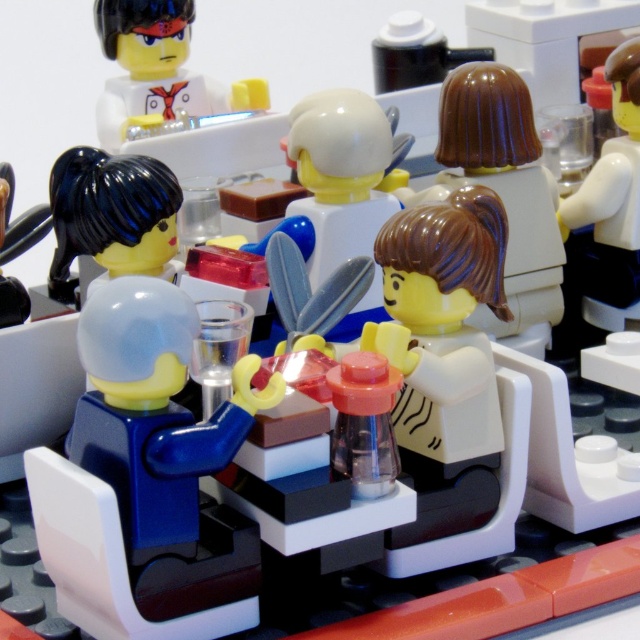
You are a photographer taking a picture of the blue matte figure at center and the brown matte hair at upper center. To ensure both are in focus, you need to know their vertical positions. Which one is positioned lower in the image?

The blue matte figure at center is located below brown matte hair at upper center, so the blue matte figure at center is positioned lower in the image.

You are a customer in the LEGO restaurant scene. You notice two items on the table in front of you. One is a brown matte hair at upper center and the other is a white glossy cup at upper right. Which item is positioned to the right side of the table?

The white glossy cup at upper right is positioned to the right side of the table because the brown matte hair at upper center is to its left.

You are a photographer standing at a distance of 30 inches from a LEGO minifigure scene. You want to take a closeup photo of the shiny black hair at left. Will you be able to focus on it clearly without moving closer?

The shiny black hair at left is 29.32 inches from the viewer, which is within the 30 inches distance you are standing at. Therefore, you can focus on it clearly without moving closer.